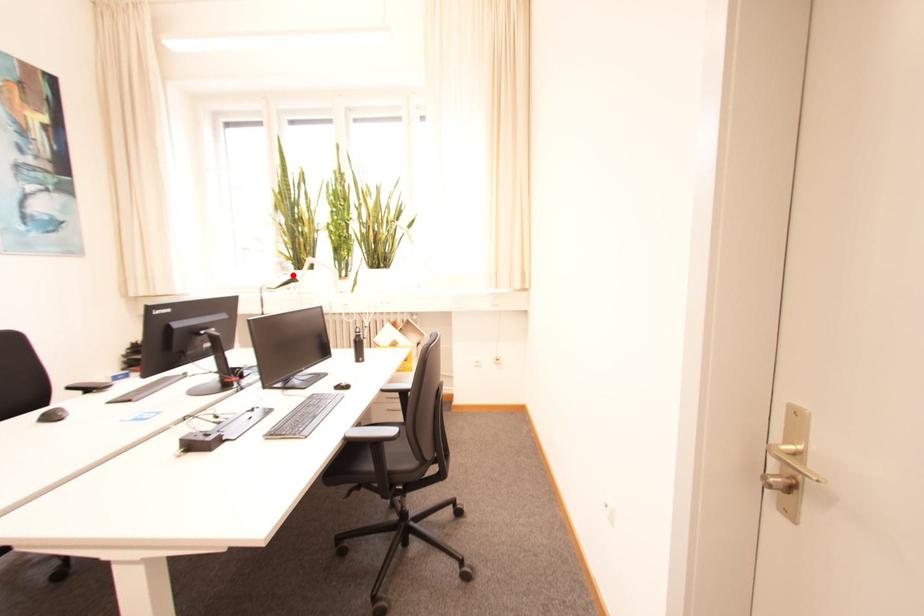
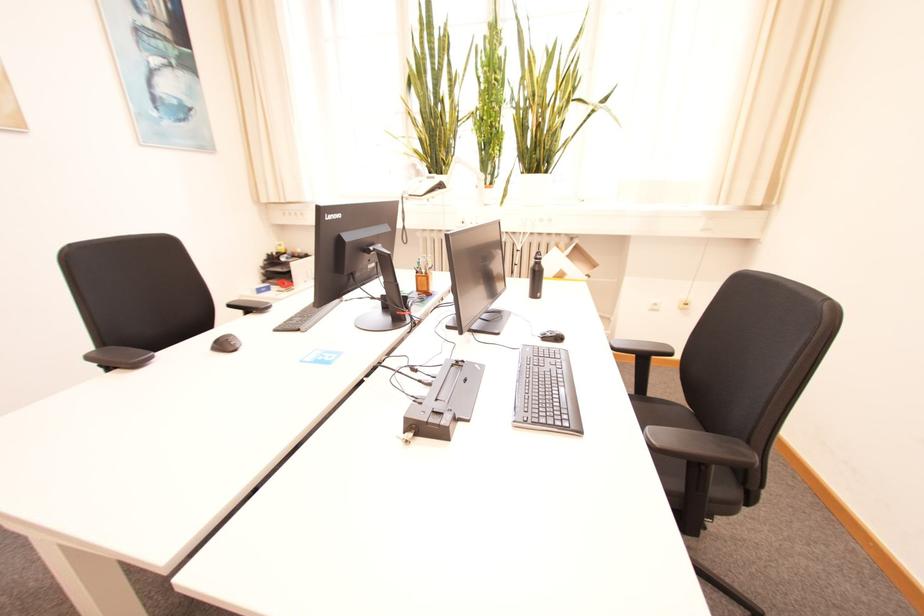
Where in the second image is the point corresponding to the highlighted location from the first image?

(440, 177)